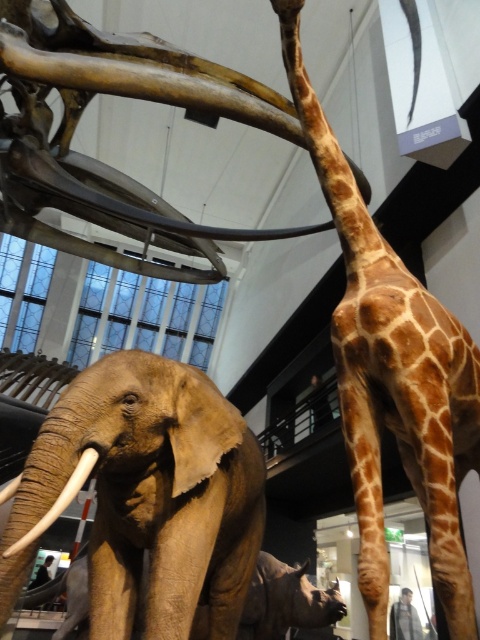
You are a museum guide holding a 18 inch long measuring tape. You need to measure the distance between the brown textured elephant at center and the matte brown tusk at lower left. Can your measuring tape reach both objects without moving it?

The distance between the brown textured elephant at center and the matte brown tusk at lower left is 19.37 inches. Since the measuring tape is only 18 inches long, it cannot fully reach both objects without moving it.

You are a visitor standing in front of the museum exhibit. You notice two points marked on the floor at coordinates point (x=451, y=579) and point (x=58, y=506). Which point is closer to you?

Point (x=451, y=579) is further to the viewer than point (x=58, y=506), so the closer point to you is point (x=58, y=506).

What can be found at the coordinates point (393, 376) in the museum exhibit?

At point (393, 376) lies brown spotted fur at center.